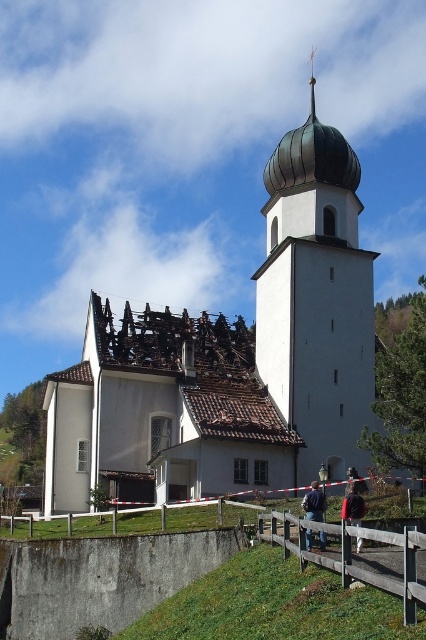
Question: Which of the following is the closest to the observer?

Choices:
 (A) (304, 348)
 (B) (403, 529)

Answer: (B)

Question: Which of the following is the farthest from the observer?

Choices:
 (A) white stucco church at center
 (B) dark brown leather jacket at center

Answer: (A)

Question: Can you confirm if denim jacket at center is smaller than dark brown leather jacket at center?

Choices:
 (A) yes
 (B) no

Answer: (A)

Question: Is wooden at lower center positioned behind denim jacket at center?

Choices:
 (A) yes
 (B) no

Answer: (B)

Question: Which of the following is the closest to the observer?

Choices:
 (A) denim jacket at center
 (B) dark brown leather jacket at center

Answer: (B)

Question: Is white stucco church at center to the left of denim jacket at center from the viewer's perspective?

Choices:
 (A) no
 (B) yes

Answer: (A)